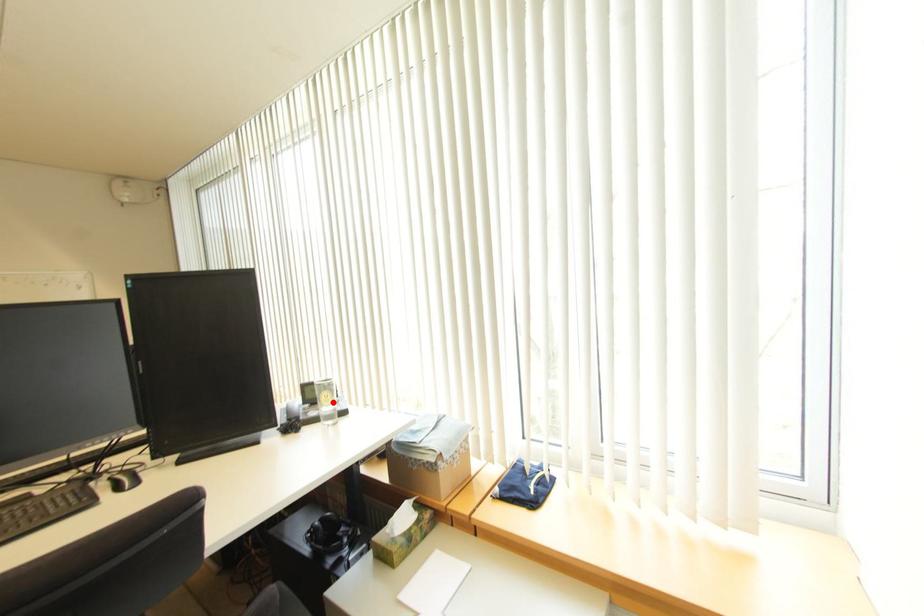
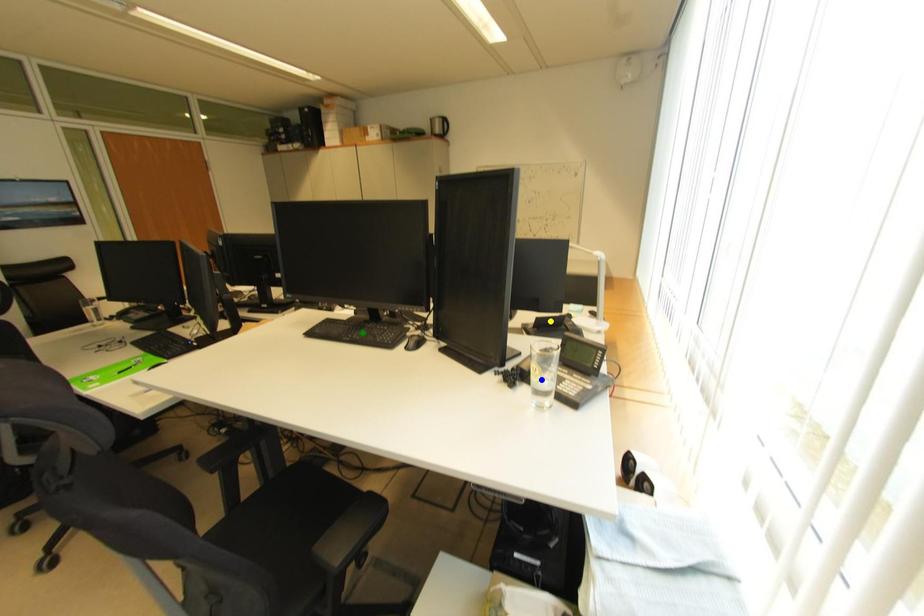
Question: I am providing you with two images of the same scene from different viewpoints. A red point is marked on the first image. You are given multiple points on the second image. Can you choose the point in image 2 that corresponds to the point in image 1?

Choices:
 (A) blue point
 (B) yellow point
 (C) green point

Answer: (A)